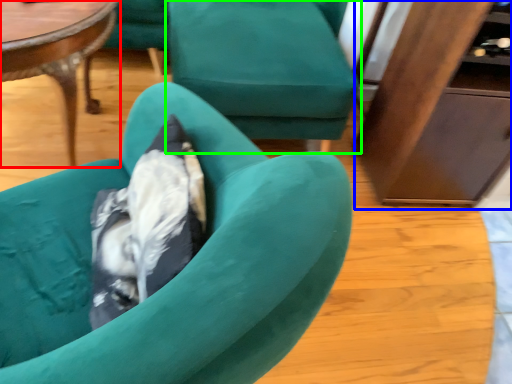
Question: Estimate the real-world distances between objects in this image. Which object is farther from coffee table (highlighted by a red box), dresser (highlighted by a blue box) or chair (highlighted by a green box)?

Choices:
 (A) dresser
 (B) chair

Answer: (A)